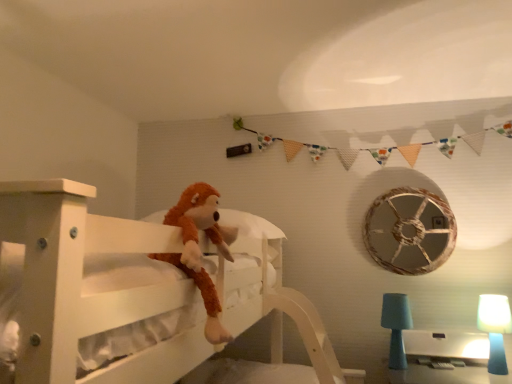
Locate an element on the screen. This screenshot has width=512, height=384. blue matte table lamp at lower right, the second table lamp positioned from the left is located at coordinates (495, 328).

Measure the distance between teal fabric lampshade at lower right, the 1th table lamp from the left, and camera.

They are 7.19 feet apart.

The image size is (512, 384). I want to click on teal fabric lampshade at lower right, the 1th table lamp from the left, so click(x=396, y=326).

Describe the element at coordinates (409, 231) in the screenshot. I see `rustic wood wheel at upper right` at that location.

Describe the element at coordinates (90, 285) in the screenshot. This screenshot has height=384, width=512. I see `white wooden bed at center` at that location.

Where is `blue matte table lamp at lower right, positioned as the 1th table lamp in right-to-left order`? Image resolution: width=512 pixels, height=384 pixels. blue matte table lamp at lower right, positioned as the 1th table lamp in right-to-left order is located at coordinates (495, 328).

Looking at this image, which of these two, white glossy table at lower right or rustic wood wheel at upper right, is wider?

white glossy table at lower right.

From the picture: Can you confirm if white glossy table at lower right is smaller than rustic wood wheel at upper right?

Indeed, white glossy table at lower right has a smaller size compared to rustic wood wheel at upper right.

From the image's perspective, between white glossy table at lower right and rustic wood wheel at upper right, who is located below?

white glossy table at lower right appears lower in the image.

Which of these two, white glossy table at lower right or rustic wood wheel at upper right, stands taller?

rustic wood wheel at upper right is taller.

Is white glossy table at lower right taller than blue matte table lamp at lower right, the second table lamp positioned from the left?

No, white glossy table at lower right is not taller than blue matte table lamp at lower right, the second table lamp positioned from the left.

The width and height of the screenshot is (512, 384). Find the location of `table lamp that appears on the right of white glossy table at lower right`. table lamp that appears on the right of white glossy table at lower right is located at coordinates (495, 328).

Which point is more distant from viewer, (415,344) or (492,301)?

The point (415,344) is farther.

Consider the image. Which is in front, white glossy table at lower right or blue matte table lamp at lower right, the second table lamp positioned from the left?

blue matte table lamp at lower right, the second table lamp positioned from the left, is in front.

Considering the sizes of objects white wooden bed at center and rustic wood wheel at upper right in the image provided, who is bigger, white wooden bed at center or rustic wood wheel at upper right?

Bigger between the two is white wooden bed at center.

What's the angular difference between white wooden bed at center and rustic wood wheel at upper right's facing directions?

The angle between the facing direction of white wooden bed at center and the facing direction of rustic wood wheel at upper right is 0.861 degrees.

Is white wooden bed at center positioned behind rustic wood wheel at upper right?

No.

Based on the photo, is brown plush toy at center next to white glossy table at lower right?

No, brown plush toy at center is not making contact with white glossy table at lower right.

Which object is more forward, brown plush toy at center or white glossy table at lower right?

brown plush toy at center is closer to the camera.

From the image's perspective, is brown plush toy at center beneath white glossy table at lower right?

No.

This screenshot has height=384, width=512. What are the coordinates of `toy above the white glossy table at lower right (from a real-world perspective)` in the screenshot? It's located at (199, 248).

Is blue matte table lamp at lower right, positioned as the 1th table lamp in right-to-left order, directly adjacent to brown plush toy at center?

No, blue matte table lamp at lower right, positioned as the 1th table lamp in right-to-left order, is not in contact with brown plush toy at center.

Which is more to the left, blue matte table lamp at lower right, the second table lamp positioned from the left, or brown plush toy at center?

Positioned to the left is brown plush toy at center.

Considering the relative sizes of blue matte table lamp at lower right, the second table lamp positioned from the left, and brown plush toy at center in the image provided, is blue matte table lamp at lower right, the second table lamp positioned from the left, taller than brown plush toy at center?

Incorrect, the height of blue matte table lamp at lower right, the second table lamp positioned from the left, is not larger of that of brown plush toy at center.

Measure the distance from blue matte table lamp at lower right, positioned as the 1th table lamp in right-to-left order, to brown plush toy at center.

The distance of blue matte table lamp at lower right, positioned as the 1th table lamp in right-to-left order, from brown plush toy at center is 1.50 meters.

Which is more to the right, rustic wood wheel at upper right or white wooden bed at center?

rustic wood wheel at upper right.

In the image, is rustic wood wheel at upper right positioned in front of or behind white wooden bed at center?

Visually, rustic wood wheel at upper right is located behind white wooden bed at center.

Can you confirm if rustic wood wheel at upper right is bigger than white wooden bed at center?

No, rustic wood wheel at upper right is not bigger than white wooden bed at center.

From the image's perspective, which one is positioned higher, rustic wood wheel at upper right or white wooden bed at center?

From the image's view, rustic wood wheel at upper right is above.

How far apart are teal fabric lampshade at lower right, marked as the 2th table lamp in a right-to-left arrangement, and white wooden bed at center?

They are 20.96 inches apart.

Is point (400, 333) positioned in front of point (250, 290)?

No.

Is teal fabric lampshade at lower right, marked as the 2th table lamp in a right-to-left arrangement, wider than white wooden bed at center?

Incorrect, the width of teal fabric lampshade at lower right, marked as the 2th table lamp in a right-to-left arrangement, does not surpass that of white wooden bed at center.

Choose the correct answer: Is teal fabric lampshade at lower right, marked as the 2th table lamp in a right-to-left arrangement, inside white wooden bed at center or outside it?

teal fabric lampshade at lower right, marked as the 2th table lamp in a right-to-left arrangement, lies outside white wooden bed at center.

Identify the location of table below the rustic wood wheel at upper right (from the image's perspective). (450, 357).

Starting from the white glossy table at lower right, which table lamp is the 2nd one in front? Please provide its 2D coordinates.

[(495, 328)]

Looking at the image, which one is located closer to white wooden bed at center, white glossy table at lower right or rustic wood wheel at upper right?

Based on the image, white glossy table at lower right appears to be nearer to white wooden bed at center.

When comparing their distances from white wooden bed at center, does white glossy table at lower right or teal fabric lampshade at lower right, marked as the 2th table lamp in a right-to-left arrangement, seem further?

white glossy table at lower right is further to white wooden bed at center.

Estimate the real-world distances between objects in this image. Which object is closer to rustic wood wheel at upper right, white glossy table at lower right or blue matte table lamp at lower right, positioned as the 1th table lamp in right-to-left order?

blue matte table lamp at lower right, positioned as the 1th table lamp in right-to-left order, is closer to rustic wood wheel at upper right.

Looking at the image, which one is located further to rustic wood wheel at upper right, white wooden bed at center or brown plush toy at center?

The object further to rustic wood wheel at upper right is brown plush toy at center.

Which object lies further to the anchor point teal fabric lampshade at lower right, the 1th table lamp from the left, white wooden bed at center or white glossy table at lower right?

white wooden bed at center lies further to teal fabric lampshade at lower right, the 1th table lamp from the left, than the other object.

When comparing their distances from brown plush toy at center, does rustic wood wheel at upper right or white glossy table at lower right seem closer?

white glossy table at lower right lies closer to brown plush toy at center than the other object.

Looking at the image, which one is located further to white glossy table at lower right, brown plush toy at center or teal fabric lampshade at lower right, marked as the 2th table lamp in a right-to-left arrangement?

The object further to white glossy table at lower right is brown plush toy at center.

Which object lies further to the anchor point white wooden bed at center, teal fabric lampshade at lower right, the 1th table lamp from the left, or blue matte table lamp at lower right, the second table lamp positioned from the left?

The object further to white wooden bed at center is blue matte table lamp at lower right, the second table lamp positioned from the left.

Identify the location of table lamp located between white wooden bed at center and teal fabric lampshade at lower right, marked as the 2th table lamp in a right-to-left arrangement, in the depth direction. [x=495, y=328].

The width and height of the screenshot is (512, 384). I want to click on table located between brown plush toy at center and blue matte table lamp at lower right, the second table lamp positioned from the left, in the left-right direction, so click(450, 357).

Where is `table between white wooden bed at center and rustic wood wheel at upper right in the front-back direction`? The width and height of the screenshot is (512, 384). table between white wooden bed at center and rustic wood wheel at upper right in the front-back direction is located at coordinates (450, 357).

Find the location of `toy located between white wooden bed at center and teal fabric lampshade at lower right, the 1th table lamp from the left, in the depth direction`. toy located between white wooden bed at center and teal fabric lampshade at lower right, the 1th table lamp from the left, in the depth direction is located at coordinates (199, 248).